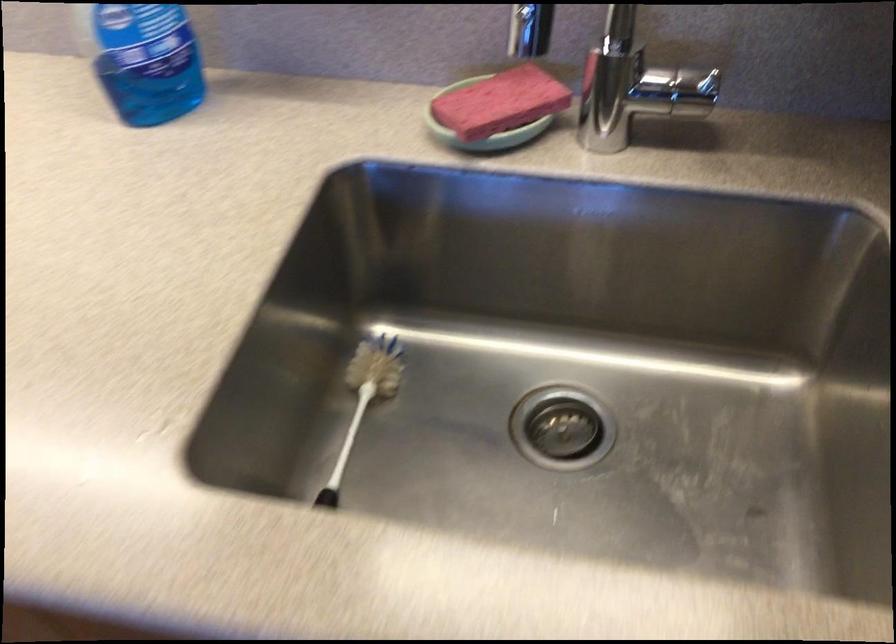
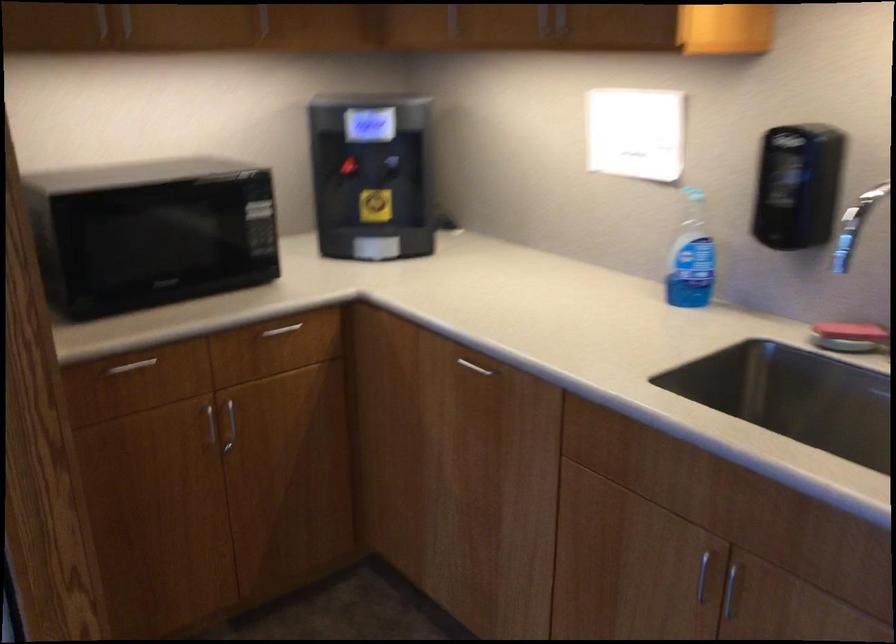
Find the pixel in the second image that matches point (486, 136) in the first image.

(848, 337)